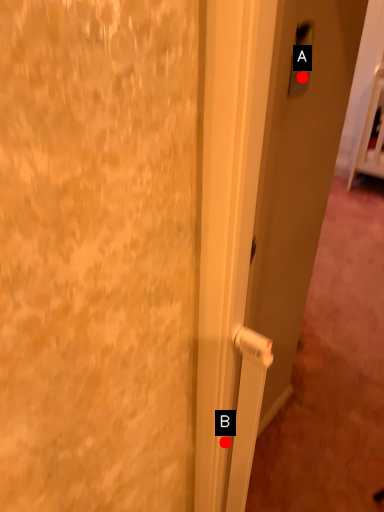
Question: Two points are circled on the image, labeled by A and B beside each circle. Which point is closer to the camera?

Choices:
 (A) A is closer
 (B) B is closer

Answer: (A)